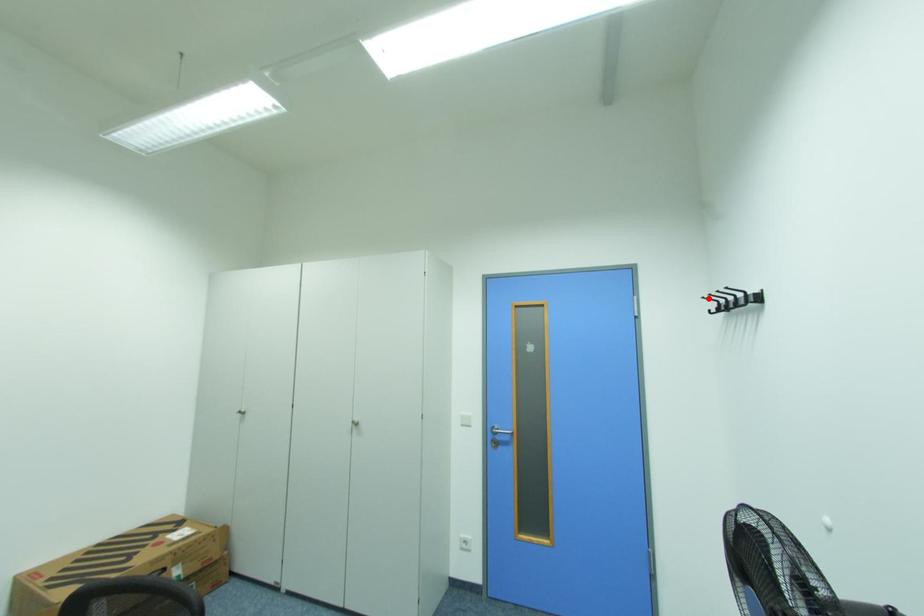
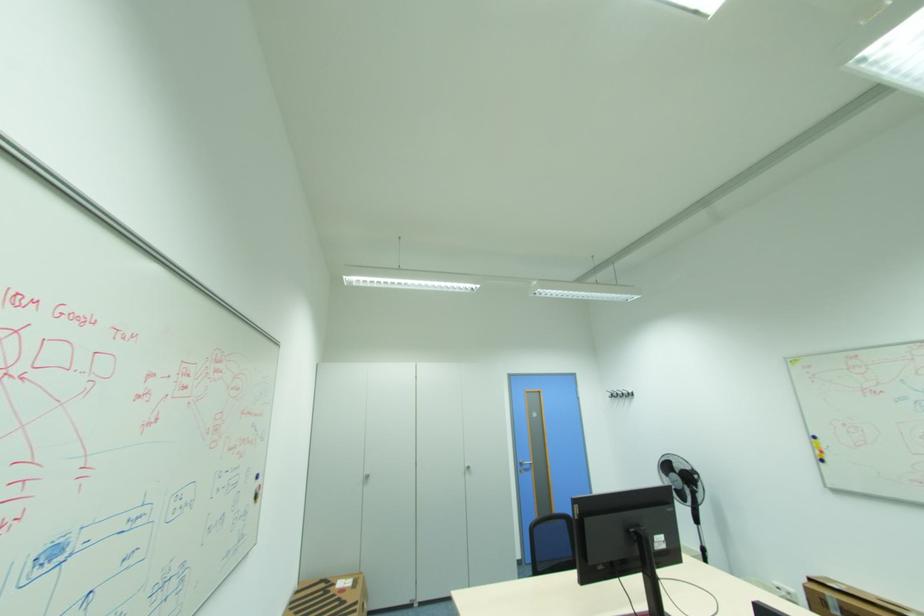
Locate, in the second image, the point that corresponds to the highlighted location in the first image.

(613, 391)